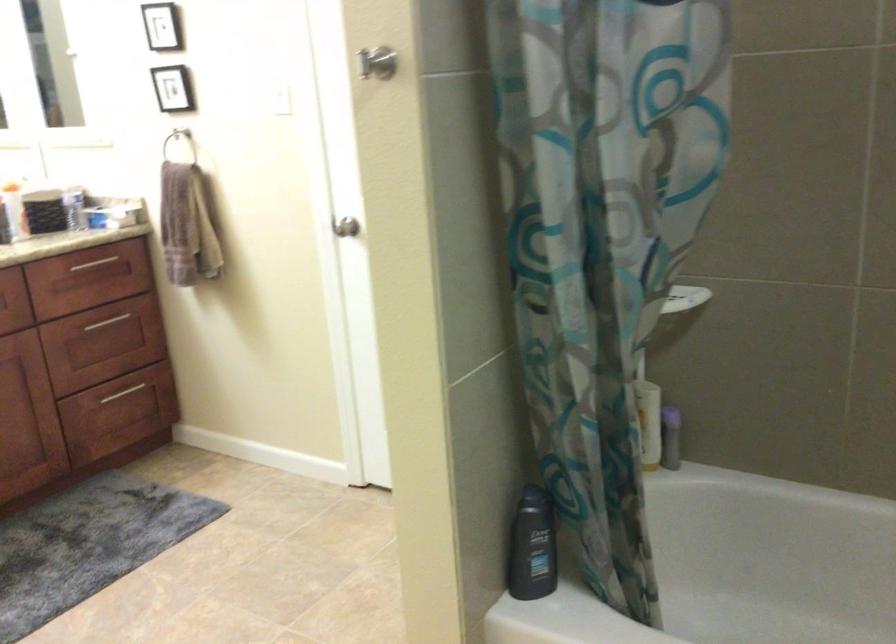
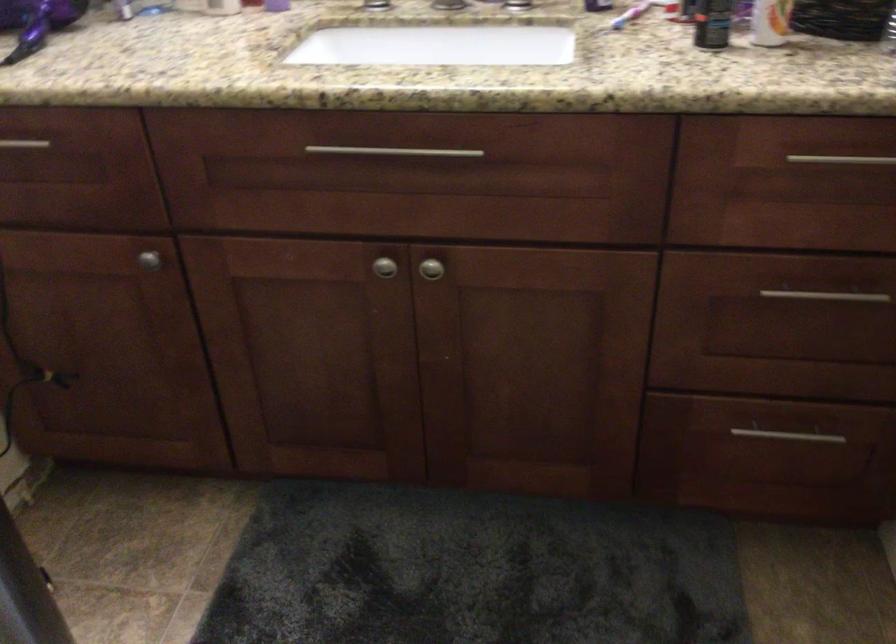
Where in the second image is the point corresponding to point (113, 328) from the first image?

(815, 310)